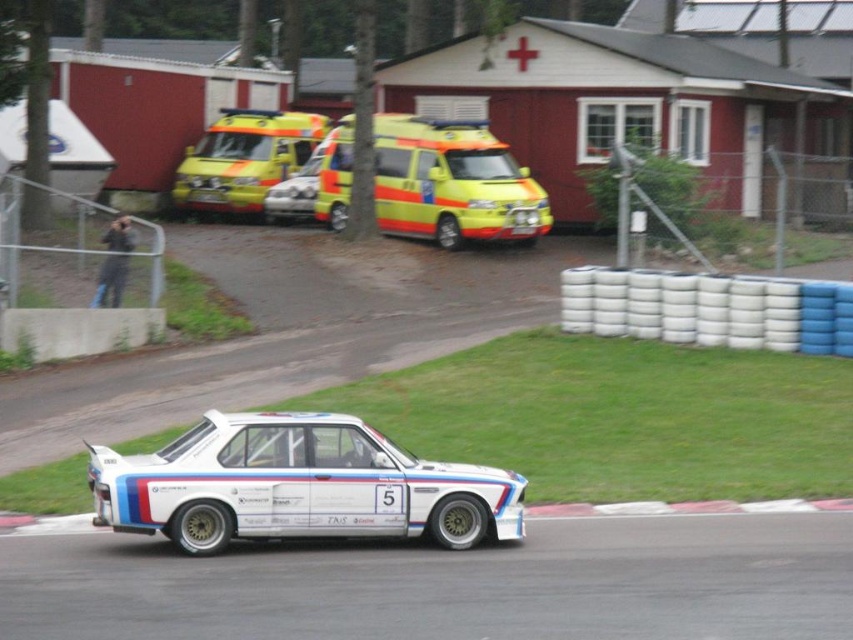
Does yellowmatteambulance at upper center come behind yellow reflective van at center?

That is False.

Is point (482, 154) closer to viewer compared to point (187, 177)?

Yes, it is.

The width and height of the screenshot is (853, 640). Describe the element at coordinates (451, 182) in the screenshot. I see `yellowmatteambulance at upper center` at that location.

At what (x,y) coordinates should I click in order to perform the action: click on yellowmatteambulance at upper center. Please return your answer as a coordinate pair (x, y). Image resolution: width=853 pixels, height=640 pixels. Looking at the image, I should click on (451, 182).

Who is more forward, (753, 595) or (352, 474)?

Point (753, 595) is more forward.

Can you confirm if white smooth asphalt at lower center is shorter than white glossy car at center?

Yes.

Does point (698, 580) come in front of point (386, 461)?

Yes, it is in front of point (386, 461).

Find the location of a particular element. Image resolution: width=853 pixels, height=640 pixels. white smooth asphalt at lower center is located at coordinates (450, 584).

Which is in front, point (256, 600) or point (399, 168)?

Point (256, 600) is in front.

Locate an element on the screen. white smooth asphalt at lower center is located at coordinates (450, 584).